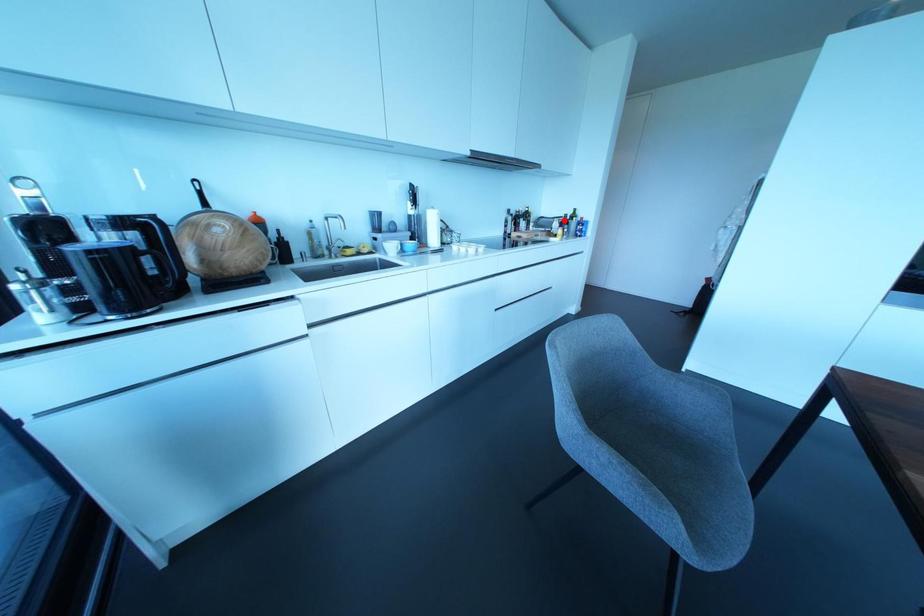
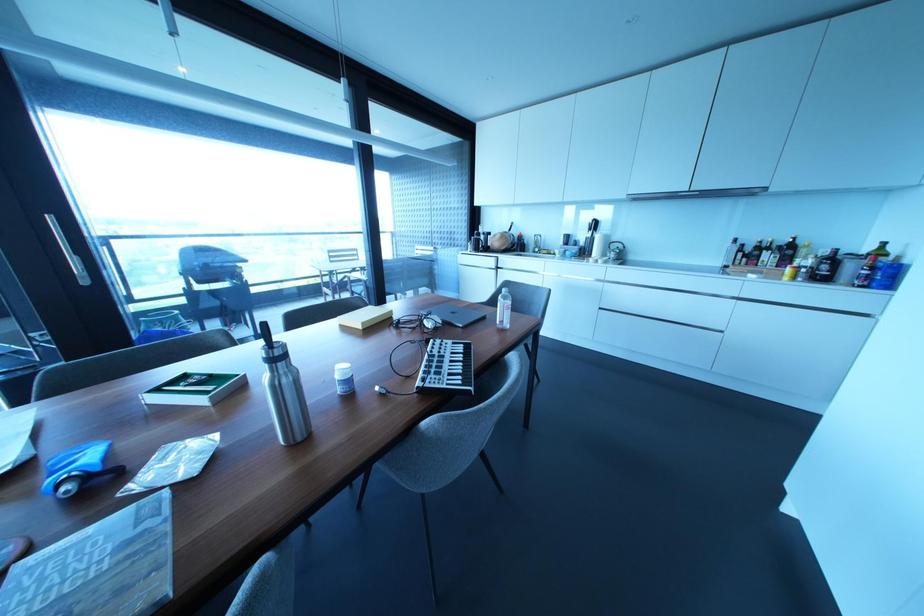
Question: I am providing you with two images of the same scene from different viewpoints. Given a red point in image1, look at the same physical point in image2. Is it:

Choices:
 (A) Closer to the viewpoint
 (B) Farther from the viewpoint

Answer: (B)